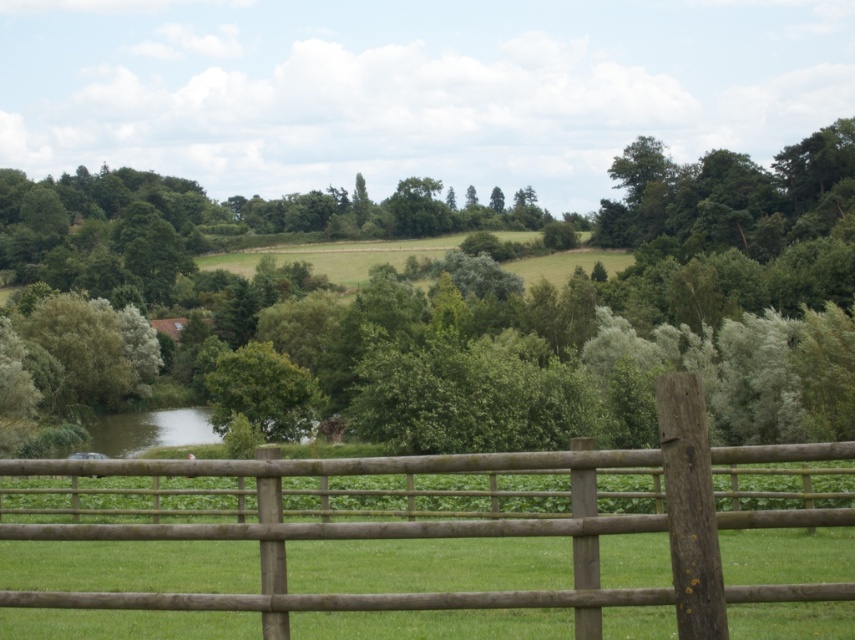
Locate an element on the screen. Image resolution: width=855 pixels, height=640 pixels. green leafy tree at center is located at coordinates (260, 390).

Between green leafy tree at center and green grassy river at lower left, which one is positioned higher?

green leafy tree at center is above.

Is point (255, 352) less distant than point (103, 432)?

Yes, point (255, 352) is closer to viewer.

Identify the location of green leafy tree at center. The width and height of the screenshot is (855, 640). (260, 390).

Is brown wooden fence at center further to the viewer compared to green grassy river at lower left?

No, brown wooden fence at center is closer to the viewer.

Is point (535, 600) in front of point (118, 440)?

Yes, it is.

Who is more forward, (282, 512) or (164, 440)?

Point (282, 512) is more forward.

Where is `brown wooden fence at center`? brown wooden fence at center is located at coordinates (502, 536).

Is point (581, 518) in front of point (227, 387)?

That is True.

Where is `brown wooden fence at center`? Image resolution: width=855 pixels, height=640 pixels. brown wooden fence at center is located at coordinates (502, 536).